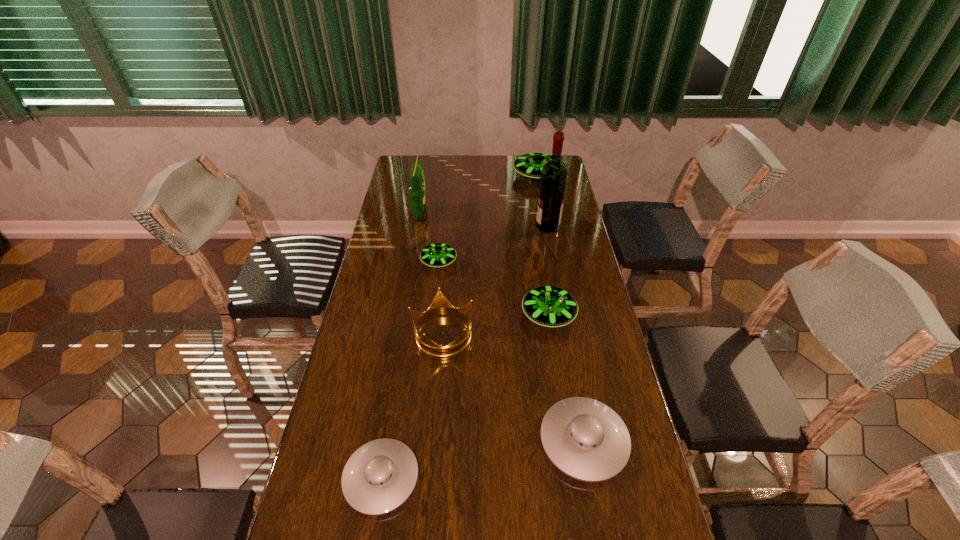
At what (x,y) coordinates should I click in order to perform the action: click on the tallest object. Please return your answer as a coordinate pair (x, y). The width and height of the screenshot is (960, 540). Looking at the image, I should click on (553, 179).

At what (x,y) coordinates should I click in order to perform the action: click on green alcohol. Please return your answer as a coordinate pair (x, y). Looking at the image, I should click on (553, 179).

Where is `green crisp (potato chip)`? The image size is (960, 540). green crisp (potato chip) is located at coordinates (417, 190).

This screenshot has width=960, height=540. I want to click on the seventh shortest object, so coord(417,190).

The height and width of the screenshot is (540, 960). I want to click on the tallest saucer, so click(529, 165).

I want to click on the farthest saucer, so click(529, 165).

What are the coordinates of `crown` in the screenshot? It's located at (440, 306).

Where is `the third nearest saucer`? The height and width of the screenshot is (540, 960). the third nearest saucer is located at coordinates (549, 306).

Where is `the fourth shortest saucer`? The width and height of the screenshot is (960, 540). the fourth shortest saucer is located at coordinates (549, 306).

This screenshot has width=960, height=540. Identify the location of the right gray saucer. (584, 438).